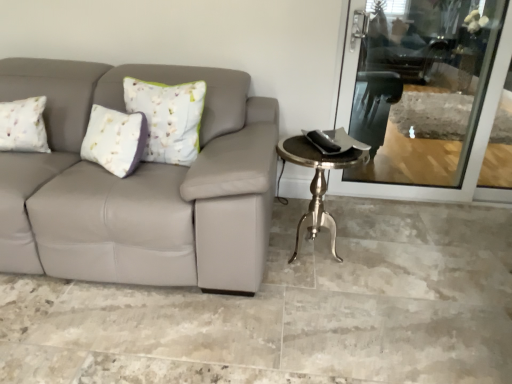
At what (x,y) coordinates should I click in order to perform the action: click on empty space that is in between silver metallic table at right and transparent glass screen door at upper right. Please return your answer as a coordinate pair (x, y). Looking at the image, I should click on (406, 229).